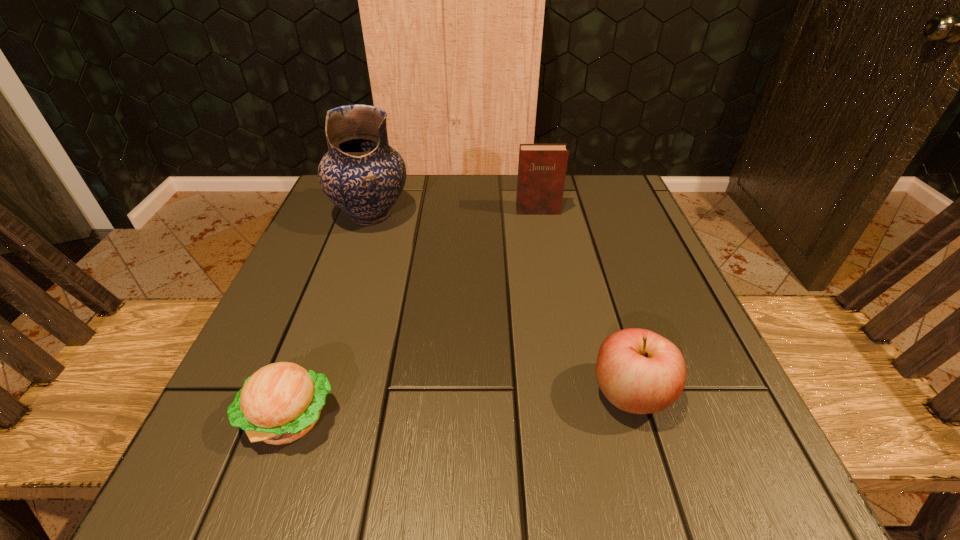
Locate an element on the screen. blank space at the near left corner is located at coordinates (274, 470).

Identify the location of vacant region at the far right corner. The height and width of the screenshot is (540, 960). (624, 200).

At what (x,y) coordinates should I click in order to perform the action: click on blank space at the near right corner. Please return your answer as a coordinate pair (x, y). The image size is (960, 540). Looking at the image, I should click on (730, 442).

You are a GUI agent. You are given a task and a screenshot of the screen. Output one action in this format:
    pyautogui.click(x=<x>, y=<y>)
    Task: Click on the empty space between the pottery and the apple
    The image size is (960, 540).
    Given the screenshot: What is the action you would take?
    [501, 304]

Find the location of a particular element. The height and width of the screenshot is (540, 960). unoccupied position between the apple and the pottery is located at coordinates (501, 304).

Locate an element on the screen. free space between the shortest object and the diary is located at coordinates (414, 314).

Locate an element on the screen. The width and height of the screenshot is (960, 540). blank region between the diary and the tallest object is located at coordinates (454, 213).

The height and width of the screenshot is (540, 960). Find the location of `free point between the second tallest object and the third tallest object`. free point between the second tallest object and the third tallest object is located at coordinates (585, 302).

This screenshot has width=960, height=540. I want to click on vacant point located between the diary and the apple, so click(x=585, y=302).

Where is `free spot between the pottery and the diary`? free spot between the pottery and the diary is located at coordinates (454, 213).